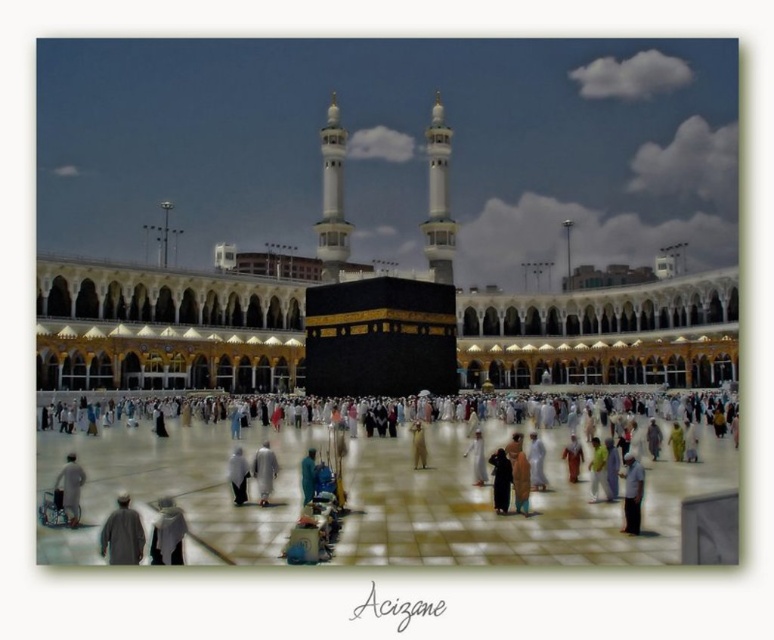
Does blue fabric person at center appear on the right side of light brown fabric person at center?

Incorrect, blue fabric person at center is not on the right side of light brown fabric person at center.

Can you confirm if blue fabric person at center is shorter than light brown fabric person at center?

In fact, blue fabric person at center may be taller than light brown fabric person at center.

Is point (300, 467) farther from camera compared to point (413, 420)?

That is False.

You are a GUI agent. You are given a task and a screenshot of the screen. Output one action in this format:
    pyautogui.click(x=<x>, y=<y>)
    Task: Click on the blue fabric person at center
    Image resolution: width=774 pixels, height=640 pixels.
    Given the screenshot: What is the action you would take?
    pyautogui.click(x=307, y=476)

Can you confirm if white clothed person at center is bigger than blue fabric person at center?

Yes, white clothed person at center is bigger than blue fabric person at center.

Is point (420, 554) behind point (303, 484)?

No, it is in front of (303, 484).

Identify the location of white clothed person at center. The image size is (774, 640). (509, 506).

Consider the image. Is black matte person at center above light gray fabric at center?

No.

What do you see at coordinates (499, 480) in the screenshot? I see `black matte person at center` at bounding box center [499, 480].

Who is more forward, (x=495, y=472) or (x=266, y=499)?

Positioned in front is point (x=495, y=472).

Locate an element on the screen. This screenshot has height=640, width=774. black matte person at center is located at coordinates (x=499, y=480).